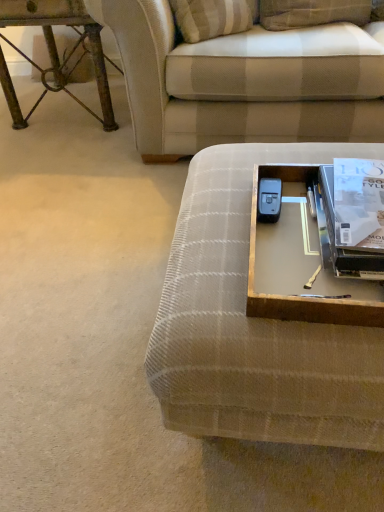
I want to click on vacant space situated above metallic silver tray at lower right (from a real-world perspective), so click(x=359, y=209).